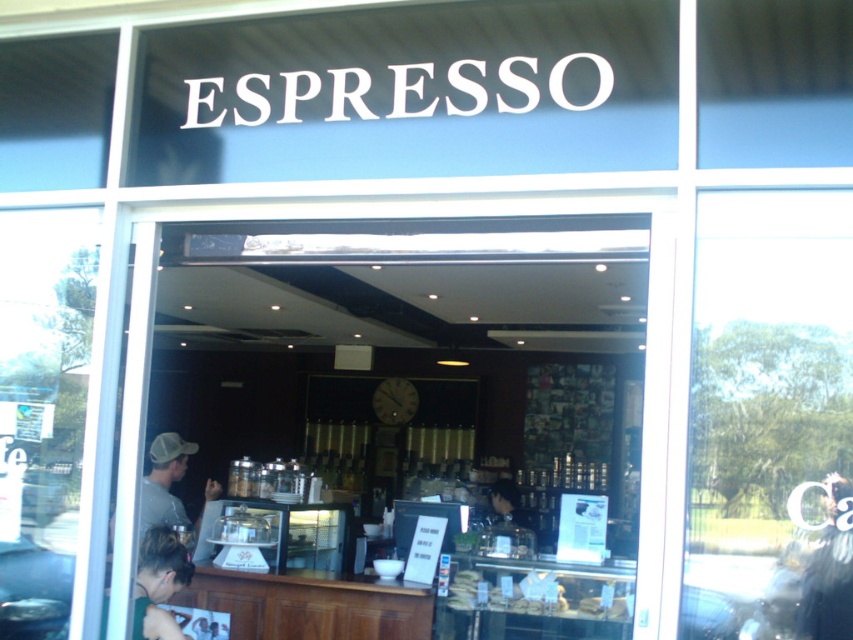
Who is taller, wooden counter at center or blonde hair at lower left?

Standing taller between the two is wooden counter at center.

Does wooden counter at center have a greater height compared to blonde hair at lower left?

Yes.

Between point (410, 516) and point (165, 534), which one is positioned behind?

The point (410, 516) is more distant.

At what (x,y) coordinates should I click in order to perform the action: click on wooden counter at center. Please return your answer as a coordinate pair (x, y). The image size is (853, 640). Looking at the image, I should click on (399, 376).

Is wooden counter at center shorter than translucent glass bread at center?

In fact, wooden counter at center may be taller than translucent glass bread at center.

Between wooden counter at center and translucent glass bread at center, which one appears on the left side from the viewer's perspective?

wooden counter at center is more to the left.

This screenshot has width=853, height=640. What are the coordinates of `wooden counter at center` in the screenshot? It's located at (399, 376).

Does transparent glass window at center have a lesser height compared to blonde hair at lower left?

No.

Who is more forward, (838, 426) or (144, 609)?

Point (838, 426) is in front.

Is point (817, 554) in front of point (160, 625)?

Yes, it is in front of point (160, 625).

The height and width of the screenshot is (640, 853). Find the location of `transparent glass window at center`. transparent glass window at center is located at coordinates (770, 419).